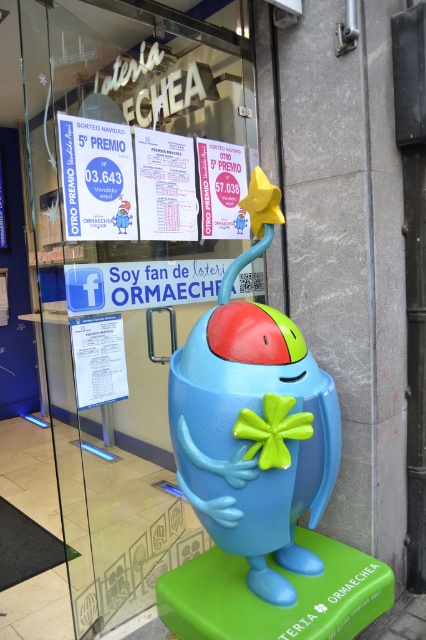
Based on the photo, you are a customer standing in front of the store and want to see both the transparent glass at center and the matte plastic toy at center. Which object will appear closer to you?

The transparent glass at center appears closer to you because it is positioned further to the viewer than the matte plastic toy at center.

You are trying to place a small sticker exactly in the center of the transparent glass at center and the matte plastic toy at center. Since both are at the center, how do you decide where to place the sticker?

The transparent glass at center has a larger width than the matte plastic toy at center, so you should place the sticker closer to the transparent glass at center to ensure it is centered between both objects.

You are a customer standing outside the store looking through the glass door. You see a white paper sign at upper left and a matte pink paper at upper center. Which one do you think is bigger in size?

The white paper sign at upper left is larger in size compared to the matte pink paper at upper center according to the description.